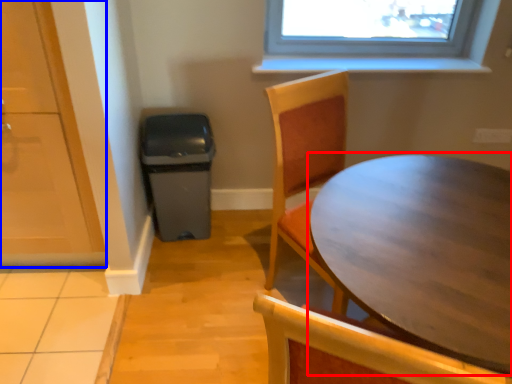
Question: Which of the following is the closest to the observer, table (highlighted by a red box) or screen door (highlighted by a blue box)?

Choices:
 (A) table
 (B) screen door

Answer: (A)